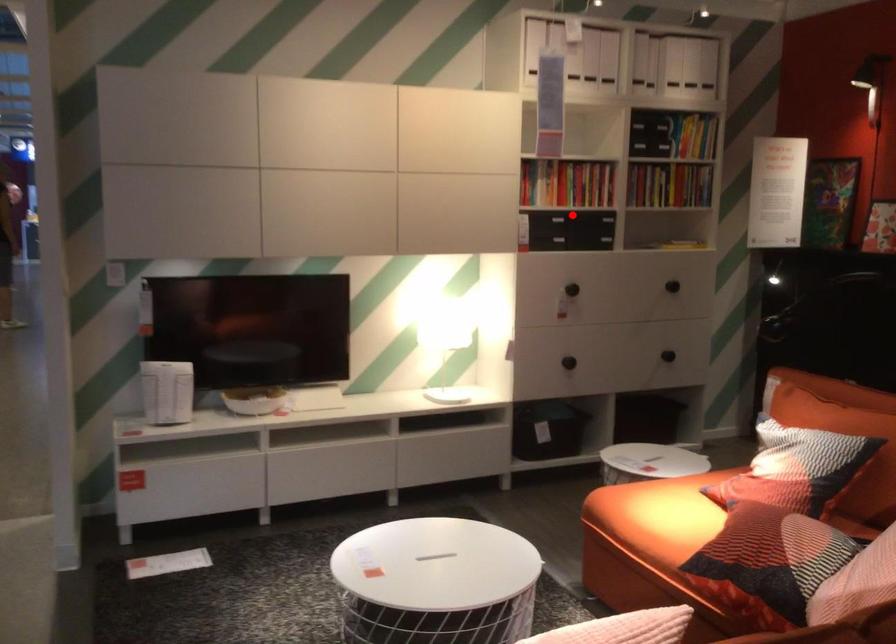
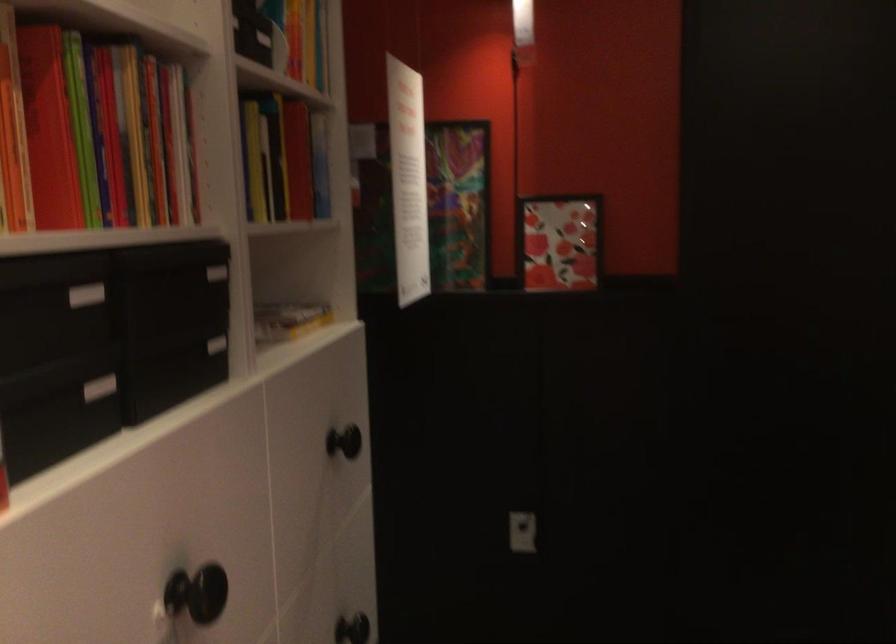
Where in the second image is the point corresponding to the highlighted location from the first image?

(99, 388)